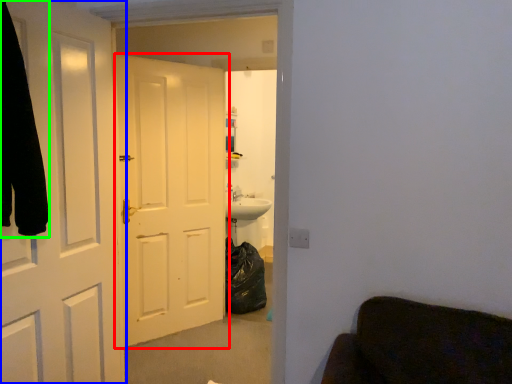
Question: Which object is the closest to the door (highlighted by a red box)? Choose among these: door (highlighted by a blue box) or robe (highlighted by a green box).

Choices:
 (A) door
 (B) robe

Answer: (A)